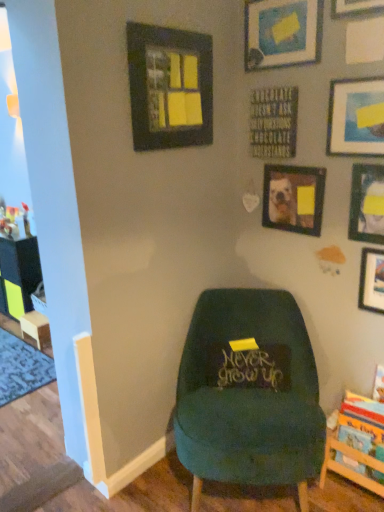
Question: From the image's perspective, would you say matte black picture frame at upper left, which is counted as the 1th picture frame, starting from the left, is positioned over velvet green chair at center?

Choices:
 (A) no
 (B) yes

Answer: (B)

Question: Considering the relative sizes of matte black picture frame at upper left, the 7th picture frame viewed from the right, and velvet green chair at center in the image provided, is matte black picture frame at upper left, the 7th picture frame viewed from the right, wider than velvet green chair at center?

Choices:
 (A) yes
 (B) no

Answer: (B)

Question: Is matte black picture frame at upper left, which is counted as the 1th picture frame, starting from the left, behind velvet green chair at center?

Choices:
 (A) yes
 (B) no

Answer: (A)

Question: Is matte black picture frame at upper left, the 7th picture frame viewed from the right, touching velvet green chair at center?

Choices:
 (A) no
 (B) yes

Answer: (A)

Question: From a real-world perspective, is matte black picture frame at upper left, which is counted as the 1th picture frame, starting from the left, located higher than velvet green chair at center?

Choices:
 (A) no
 (B) yes

Answer: (B)

Question: Can you confirm if matte black picture frame at upper left, the 7th picture frame viewed from the right, is positioned to the left of velvet green chair at center?

Choices:
 (A) yes
 (B) no

Answer: (A)

Question: Would you consider wooden picture frame at upper right, the 4th picture frame from the left, to be distant from wooden bookshelf at lower right?

Choices:
 (A) no
 (B) yes

Answer: (B)

Question: Is wooden picture frame at upper right, the fourth picture frame when ordered from right to left, next to wooden bookshelf at lower right?

Choices:
 (A) no
 (B) yes

Answer: (A)

Question: Is wooden picture frame at upper right, the 4th picture frame from the left, taller than wooden bookshelf at lower right?

Choices:
 (A) yes
 (B) no

Answer: (B)

Question: Can you confirm if wooden picture frame at upper right, the 4th picture frame from the left, is shorter than wooden bookshelf at lower right?

Choices:
 (A) yes
 (B) no

Answer: (A)

Question: From a real-world perspective, is wooden picture frame at upper right, the fourth picture frame when ordered from right to left, beneath wooden bookshelf at lower right?

Choices:
 (A) no
 (B) yes

Answer: (A)

Question: Considering the relative sizes of wooden picture frame at upper right, the 4th picture frame from the left, and wooden bookshelf at lower right in the image provided, is wooden picture frame at upper right, the 4th picture frame from the left, bigger than wooden bookshelf at lower right?

Choices:
 (A) no
 (B) yes

Answer: (A)

Question: Does wooden at left appear on the right side of velvet green chair at center?

Choices:
 (A) yes
 (B) no

Answer: (B)